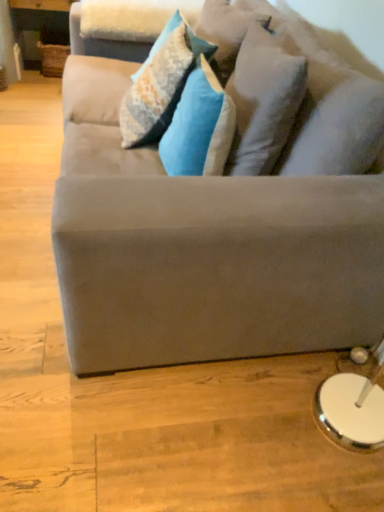
Question: Considering the positions of point (178, 145) and point (276, 60), is point (178, 145) closer or farther from the camera than point (276, 60)?

Choices:
 (A) farther
 (B) closer

Answer: (A)

Question: From the image's perspective, is textured blue pillow at center, which is the 2th pillow from right to left, above or below white soft pillow at upper center, which is the first pillow from right to left?

Choices:
 (A) above
 (B) below

Answer: (B)

Question: Which is farther from the suede gray couch at center?

Choices:
 (A) velvet blue pillow at center, positioned as the 3th pillow in right-to-left order
 (B) textured blue pillow at center, which is the 2th pillow from right to left
 (C) white soft pillow at upper center, which is the first pillow from right to left

Answer: (A)

Question: Which object is positioned farthest from the suede gray couch at center?

Choices:
 (A) white soft pillow at upper center, which is the first pillow from right to left
 (B) textured blue pillow at center, which is counted as the 2th pillow, starting from the left
 (C) velvet blue pillow at center, which ranks as the first pillow in left-to-right order

Answer: (C)